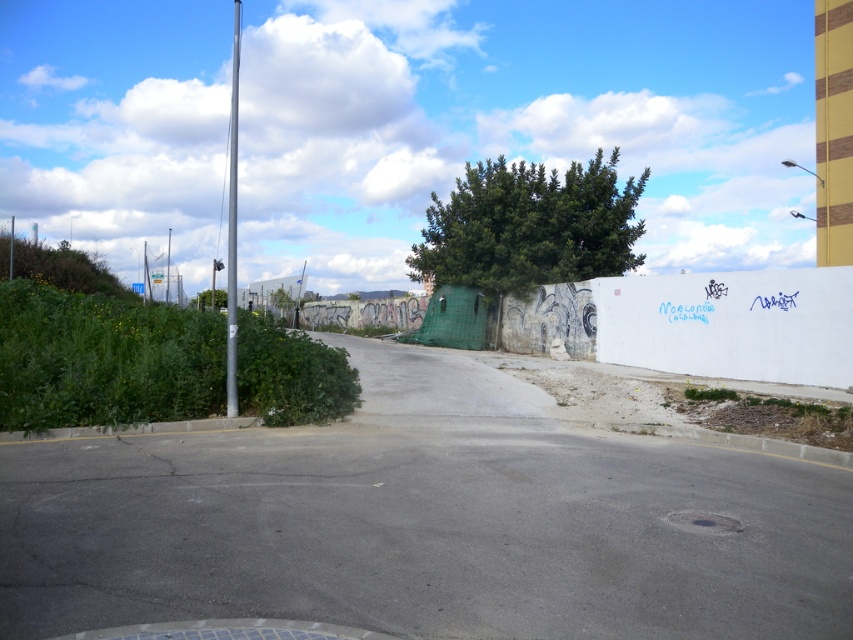
You are a bird looking for a higher perch. You see a green leafy tree at center and a blue plastic sign at upper left. Which one should you choose to get a higher vantage point?

The green leafy tree at center has a greater height compared to the blue plastic sign at upper left, so you should choose the green leafy tree at center for a higher vantage point.